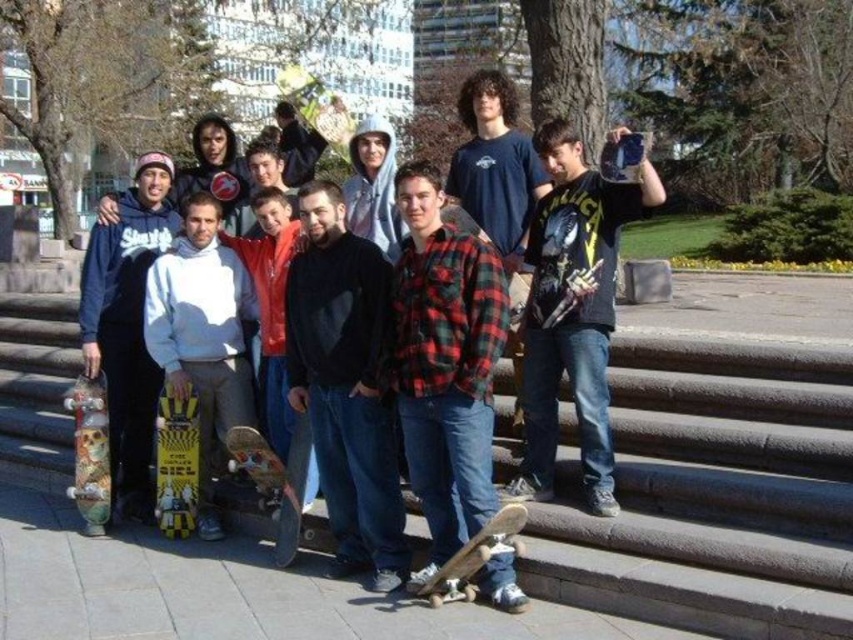
Does point (291, 536) lie behind point (103, 448)?

No, (291, 536) is closer to viewer.

Is wooden skateboard at center in front of skull-patterned wood skateboard at lower left?

Yes, it is.

Who is more distant from viewer, (306, 433) or (106, 428)?

Positioned behind is point (106, 428).

Find the location of a particular element. This screenshot has height=640, width=853. wooden skateboard at center is located at coordinates coord(274,480).

Does matte black hoodie at left appear over skull-patterned wood skateboard at lower left?

Incorrect, matte black hoodie at left is not positioned above skull-patterned wood skateboard at lower left.

From the picture: Can you confirm if matte black hoodie at left is taller than skull-patterned wood skateboard at lower left?

Incorrect, matte black hoodie at left's height is not larger of skull-patterned wood skateboard at lower left's.

Does point (102, 323) lie in front of point (91, 429)?

No, it is behind (91, 429).

This screenshot has width=853, height=640. I want to click on matte black hoodie at left, so click(126, 324).

Is white matte skateboard at center to the left of yellowwoodenskateboard at center from the viewer's perspective?

In fact, white matte skateboard at center is to the right of yellowwoodenskateboard at center.

Identify the location of white matte skateboard at center. Image resolution: width=853 pixels, height=640 pixels. (202, 336).

Between point (155, 307) and point (184, 461), which one is positioned behind?

The point (155, 307) is more distant.

At what (x,y) coordinates should I click in order to perform the action: click on white matte skateboard at center. Please return your answer as a coordinate pair (x, y). Image resolution: width=853 pixels, height=640 pixels. Looking at the image, I should click on (202, 336).